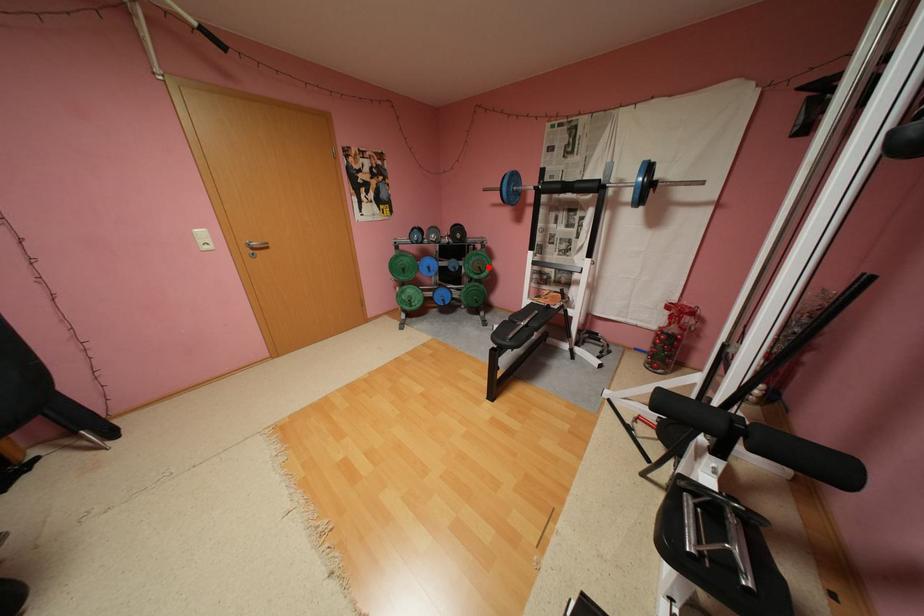
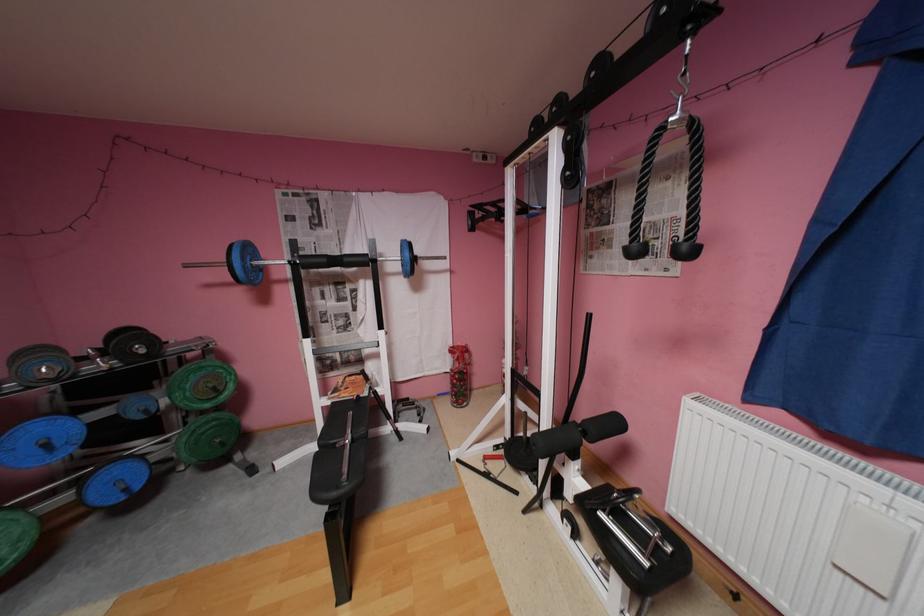
In the second image, find the point that corresponds to the highlighted location in the first image.

(224, 387)